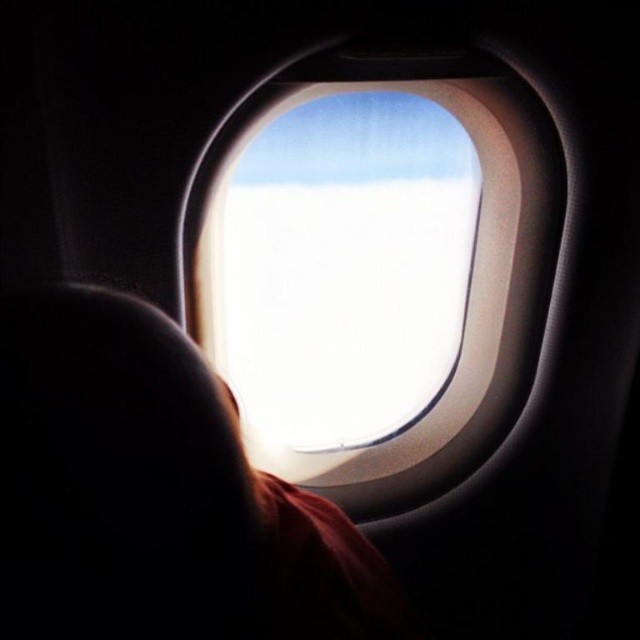
Which of these two, silky red hair at center or transparent glass airplane window at center, stands taller?

With more height is transparent glass airplane window at center.

From the picture: Does silky red hair at center appear over transparent glass airplane window at center?

No, silky red hair at center is not above transparent glass airplane window at center.

Locate an element on the screen. Image resolution: width=640 pixels, height=640 pixels. silky red hair at center is located at coordinates (156, 493).

You are a GUI agent. You are given a task and a screenshot of the screen. Output one action in this format:
    pyautogui.click(x=<x>, y=<y>)
    Task: Click on the silky red hair at center
    The height and width of the screenshot is (640, 640).
    Given the screenshot: What is the action you would take?
    pyautogui.click(x=156, y=493)